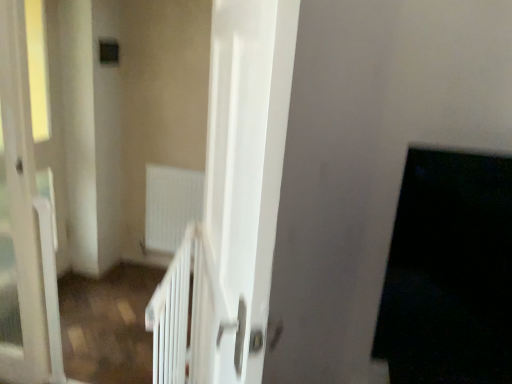
In order to click on transparent glass screen door at left, which is the 1th screen door in left-to-right order in this screenshot , I will do `click(22, 217)`.

At what (x,y) coordinates should I click in order to perform the action: click on white matte radiator at center. Please return your answer as a coordinate pair (x, y). Looking at the image, I should click on tap(170, 205).

From the picture: Which of these two, white glossy door at center, which is the first screen door in right-to-left order, or transparent glass screen door at left, which is the 1th screen door in left-to-right order, is smaller?

Smaller between the two is transparent glass screen door at left, which is the 1th screen door in left-to-right order.

Which object is wider, white glossy door at center, which is the first screen door in right-to-left order, or transparent glass screen door at left, which is the 1th screen door in left-to-right order?

With larger width is transparent glass screen door at left, which is the 1th screen door in left-to-right order.

Consider the image. From a real-world perspective, which object stands above the other?

white glossy door at center, the 2th screen door from the left, from a real-world perspective.

Which is in front, white glossy door at center, the 2th screen door from the left, or black matte door at right?

white glossy door at center, the 2th screen door from the left, is in front.

Image resolution: width=512 pixels, height=384 pixels. Identify the location of dark below the white glossy door at center, which is the first screen door in right-to-left order (from a real-world perspective). (449, 272).

Consider the image. From a real-world perspective, is white glossy door at center, the 2th screen door from the left, positioned under black matte door at right based on gravity?

Incorrect, from a real-world perspective, white glossy door at center, the 2th screen door from the left, is higher than black matte door at right.

Which of these two, white glossy door at center, the 2th screen door from the left, or black matte door at right, is wider?

With larger width is black matte door at right.

Considering the relative positions of transparent glass screen door at left, placed as the 2th screen door when sorted from right to left, and white glossy door at center, the 2th screen door from the left, in the image provided, is transparent glass screen door at left, placed as the 2th screen door when sorted from right to left, to the right of white glossy door at center, the 2th screen door from the left, from the viewer's perspective?

Incorrect, transparent glass screen door at left, placed as the 2th screen door when sorted from right to left, is not on the right side of white glossy door at center, the 2th screen door from the left.

Identify the location of screen door located in front of the transparent glass screen door at left, which is the 1th screen door in left-to-right order. (246, 171).

Can you tell me how much transparent glass screen door at left, placed as the 2th screen door when sorted from right to left, and white glossy door at center, the 2th screen door from the left, differ in facing direction?

The angle between the facing direction of transparent glass screen door at left, placed as the 2th screen door when sorted from right to left, and the facing direction of white glossy door at center, the 2th screen door from the left, is 63.9 degrees.

Is transparent glass screen door at left, which is the 1th screen door in left-to-right order, in front of or behind white glossy door at center, which is the first screen door in right-to-left order, in the image?

Clearly, transparent glass screen door at left, which is the 1th screen door in left-to-right order, is behind white glossy door at center, which is the first screen door in right-to-left order.

From the picture: Is white matte radiator at center shorter than black matte door at right?

Yes, white matte radiator at center is shorter than black matte door at right.

Considering the positions of points (203, 182) and (482, 315), is point (203, 182) farther from camera compared to point (482, 315)?

Yes, point (203, 182) is farther from viewer.

Looking at this image, considering the positions of objects white matte radiator at center and black matte door at right in the image provided, who is in front, white matte radiator at center or black matte door at right?

Positioned in front is black matte door at right.

Which is less distant, (505, 363) or (251, 334)?

The point (251, 334) is more forward.

Which object is positioned more to the right, black matte door at right or white glossy door at center, the 2th screen door from the left?

From the viewer's perspective, black matte door at right appears more on the right side.

Is black matte door at right further to the viewer compared to white glossy door at center, which is the first screen door in right-to-left order?

That is True.

Between black matte door at right and white glossy door at center, which is the first screen door in right-to-left order, which one has larger width?

Wider between the two is black matte door at right.

Is white matte radiator at center inside black matte door at right?

No.

Can you tell me how much black matte door at right and white matte radiator at center differ in facing direction?

They differ by 3.77 degrees in their facing directions.

Where is `dark that is below the white matte radiator at center (from the image's perspective)`? The image size is (512, 384). dark that is below the white matte radiator at center (from the image's perspective) is located at coordinates (449, 272).

Is black matte door at right far away from white matte radiator at center?

Yes, black matte door at right and white matte radiator at center are located far from each other.

Does transparent glass screen door at left, which is the 1th screen door in left-to-right order, have a greater width compared to black matte door at right?

No, transparent glass screen door at left, which is the 1th screen door in left-to-right order, is not wider than black matte door at right.

Is transparent glass screen door at left, which is the 1th screen door in left-to-right order, oriented away from black matte door at right?

No, transparent glass screen door at left, which is the 1th screen door in left-to-right order, is not facing away from black matte door at right.

Is transparent glass screen door at left, placed as the 2th screen door when sorted from right to left, placed right next to black matte door at right?

No, transparent glass screen door at left, placed as the 2th screen door when sorted from right to left, is not in contact with black matte door at right.

From a real-world perspective, is transparent glass screen door at left, placed as the 2th screen door when sorted from right to left, positioned above or below black matte door at right?

In terms of real-world spatial position, transparent glass screen door at left, placed as the 2th screen door when sorted from right to left, is below black matte door at right.

At what (x,y) coordinates should I click in order to perform the action: click on screen door to the right of transparent glass screen door at left, which is the 1th screen door in left-to-right order. Please return your answer as a coordinate pair (x, y). This screenshot has height=384, width=512. Looking at the image, I should click on (246, 171).

Find the location of a particular element. Image resolution: width=512 pixels, height=384 pixels. screen door located above the black matte door at right (from a real-world perspective) is located at coordinates (246, 171).

From the image, which object appears to be nearer to white glossy door at center, the 2th screen door from the left, black matte door at right or white matte radiator at center?

The object closer to white glossy door at center, the 2th screen door from the left, is black matte door at right.

Looking at this image, estimate the real-world distances between objects in this image. Which object is closer to white glossy door at center, the 2th screen door from the left, white matte radiator at center or black matte door at right?

Based on the image, black matte door at right appears to be nearer to white glossy door at center, the 2th screen door from the left.

Based on their spatial positions, is white glossy door at center, the 2th screen door from the left, or transparent glass screen door at left, placed as the 2th screen door when sorted from right to left, further from black matte door at right?

transparent glass screen door at left, placed as the 2th screen door when sorted from right to left.

When comparing their distances from black matte door at right, does white matte radiator at center or transparent glass screen door at left, placed as the 2th screen door when sorted from right to left, seem closer?

transparent glass screen door at left, placed as the 2th screen door when sorted from right to left, is closer to black matte door at right.

Based on their spatial positions, is white glossy door at center, the 2th screen door from the left, or white matte radiator at center further from transparent glass screen door at left, placed as the 2th screen door when sorted from right to left?

white matte radiator at center.

Looking at the image, which one is located further to black matte door at right, white matte radiator at center or white glossy door at center, the 2th screen door from the left?

Among the two, white matte radiator at center is located further to black matte door at right.

From the image, which object appears to be nearer to white glossy door at center, which is the first screen door in right-to-left order, transparent glass screen door at left, which is the 1th screen door in left-to-right order, or white matte radiator at center?

Answer: transparent glass screen door at left, which is the 1th screen door in left-to-right order.

Estimate the real-world distances between objects in this image. Which object is further from transparent glass screen door at left, which is the 1th screen door in left-to-right order, white matte radiator at center or white glossy door at center, which is the first screen door in right-to-left order?

white matte radiator at center is further to transparent glass screen door at left, which is the 1th screen door in left-to-right order.

The height and width of the screenshot is (384, 512). In order to click on screen door between transparent glass screen door at left, placed as the 2th screen door when sorted from right to left, and black matte door at right, in the horizontal direction in this screenshot , I will do `click(246, 171)`.

Find the location of a particular element. The image size is (512, 384). dark between white glossy door at center, the 2th screen door from the left, and white matte radiator at center, along the z-axis is located at coordinates (x=449, y=272).

Where is `screen door between white glossy door at center, the 2th screen door from the left, and white matte radiator at center from front to back`? This screenshot has height=384, width=512. screen door between white glossy door at center, the 2th screen door from the left, and white matte radiator at center from front to back is located at coordinates (22, 217).

Locate an element on the screen. Image resolution: width=512 pixels, height=384 pixels. screen door between black matte door at right and white matte radiator at center along the z-axis is located at coordinates (22, 217).